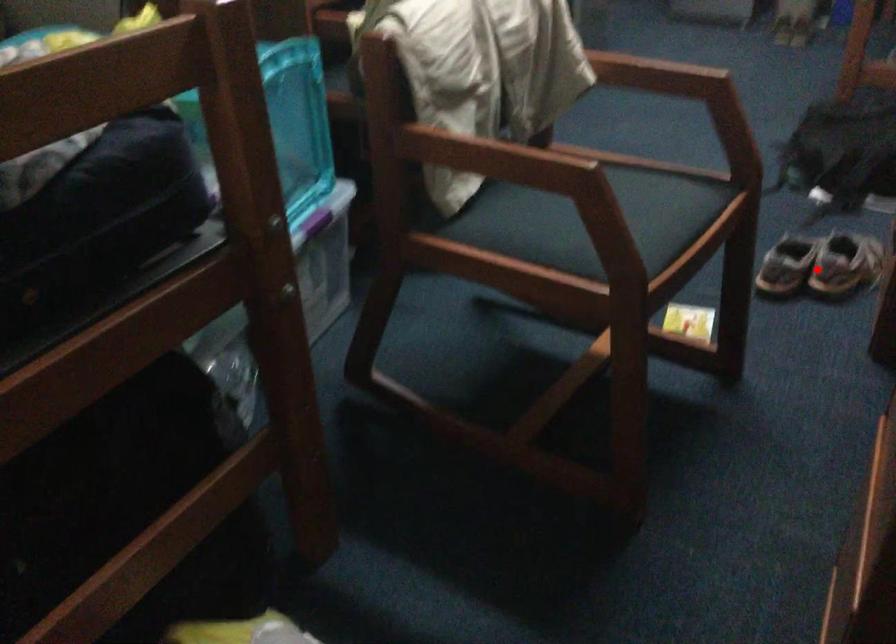
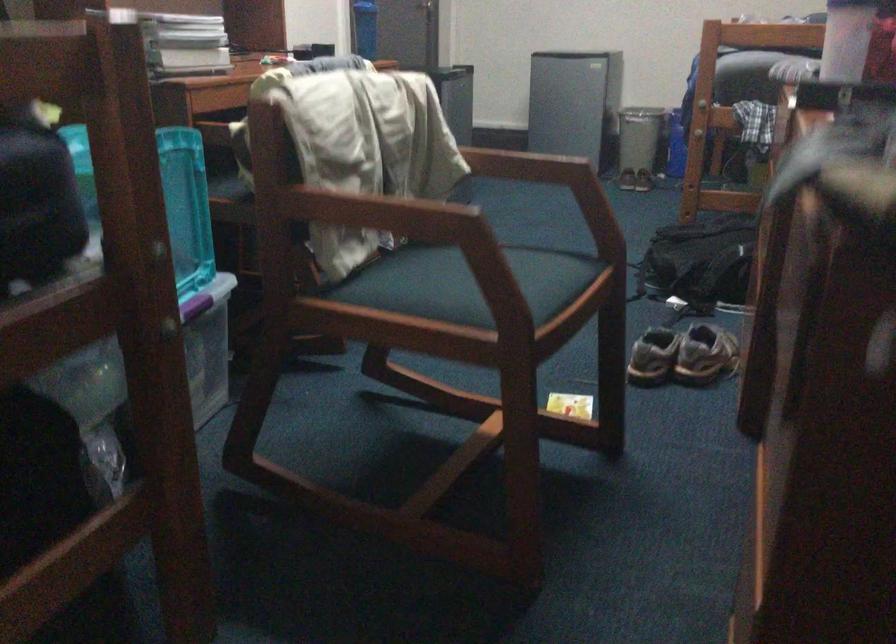
In the second image, find the point that corresponds to the highlighted location in the first image.

(682, 355)